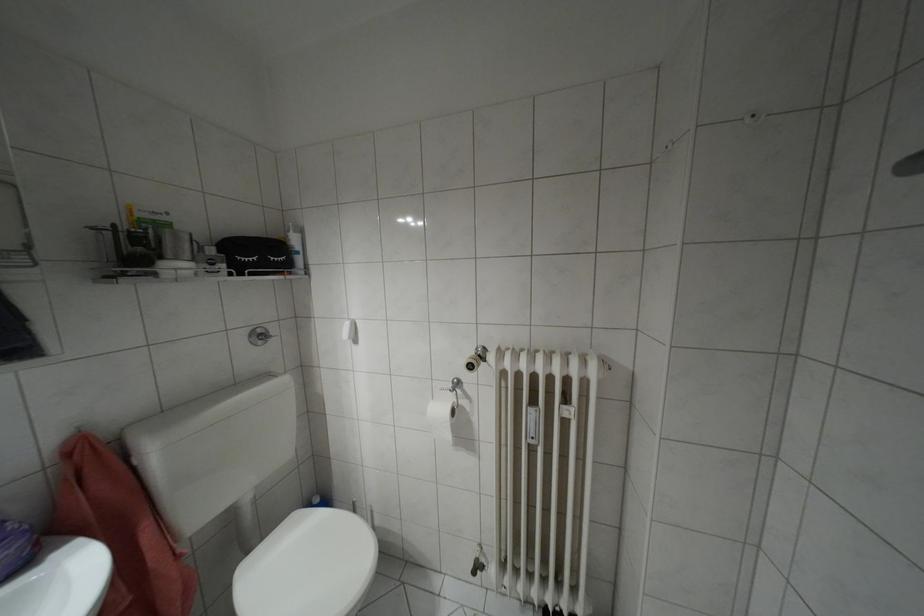
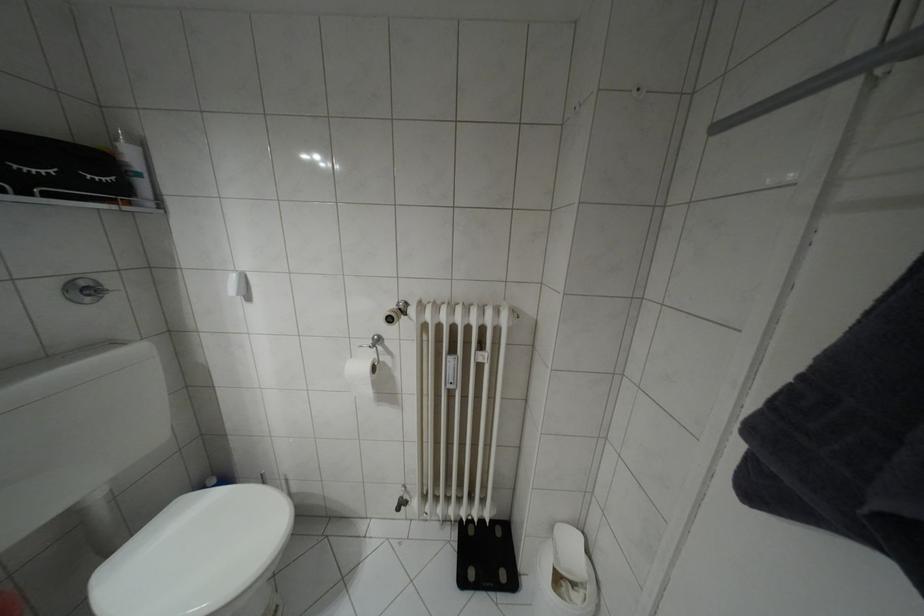
Question: The first image is from the beginning of the video and the second image is from the end. How did the camera likely rotate when shooting the video?

Choices:
 (A) Left
 (B) Right
 (C) Up
 (D) Down

Answer: (B)